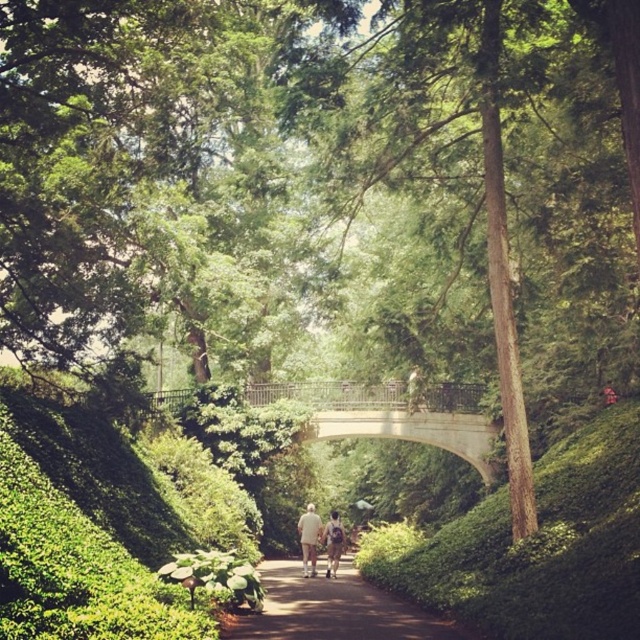
Question: Which point is closer to the camera taking this photo?

Choices:
 (A) (349, 625)
 (B) (474, 449)
 (C) (300, 531)

Answer: (A)

Question: Which object appears closest to the camera in this image?

Choices:
 (A) light beige fabric at center
 (B) brown dirt path at center

Answer: (B)

Question: Does concrete stone bridge at center have a smaller size compared to light beige fabric at center?

Choices:
 (A) no
 (B) yes

Answer: (A)

Question: Among these points, which one is farthest from the camera?

Choices:
 (A) (484, 458)
 (B) (333, 531)
 (C) (332, 525)

Answer: (A)

Question: Can you confirm if brown dirt path at center is smaller than light beige fabric couple at center?

Choices:
 (A) yes
 (B) no

Answer: (B)

Question: Does brown dirt path at center appear over light beige fabric couple at center?

Choices:
 (A) no
 (B) yes

Answer: (B)